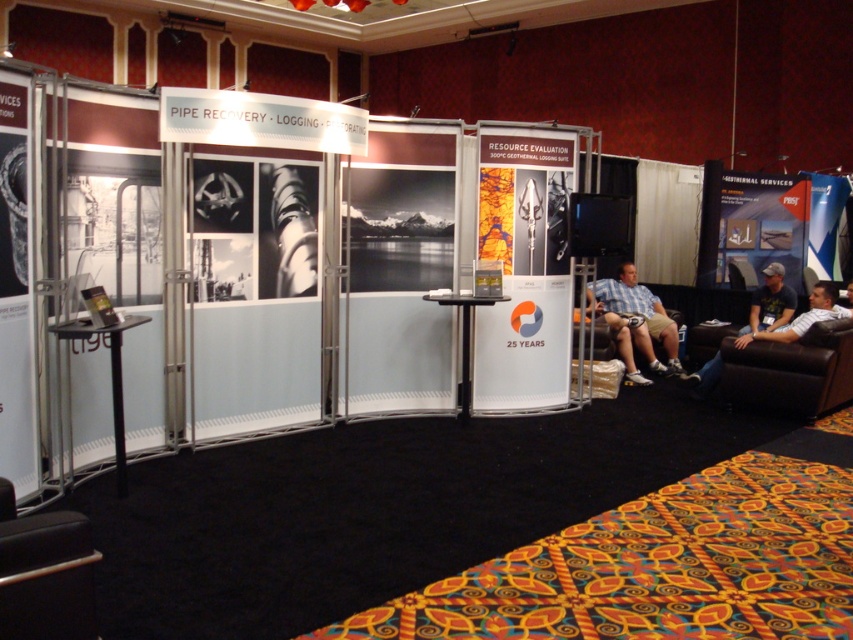
Who is taller, white paperboard poster at center or metallic silver pipe at left?

With more height is white paperboard poster at center.

Can you confirm if white paperboard poster at center is positioned to the right of metallic silver pipe at left?

Indeed, white paperboard poster at center is positioned on the right side of metallic silver pipe at left.

Where is `white paperboard poster at center`? The width and height of the screenshot is (853, 640). white paperboard poster at center is located at coordinates (524, 266).

Who is shorter, matte blue poster at right or blue fabric banner at upper right?

Standing shorter between the two is blue fabric banner at upper right.

Is point (776, 205) closer to camera compared to point (827, 227)?

Yes.

Between point (767, 208) and point (831, 228), which one is positioned in front?

Positioned in front is point (767, 208).

This screenshot has width=853, height=640. In order to click on matte blue poster at right in this screenshot , I will do `click(759, 227)`.

Measure the distance between point [514,192] and camera.

Point [514,192] is 5.63 meters away from camera.

Who is lower down, white paperboard poster at center or black leather armchair at lower left?

black leather armchair at lower left is lower down.

Is point (552, 317) less distant than point (22, 576)?

No, (552, 317) is behind (22, 576).

Where is `white paperboard poster at center`? The height and width of the screenshot is (640, 853). white paperboard poster at center is located at coordinates (524, 266).